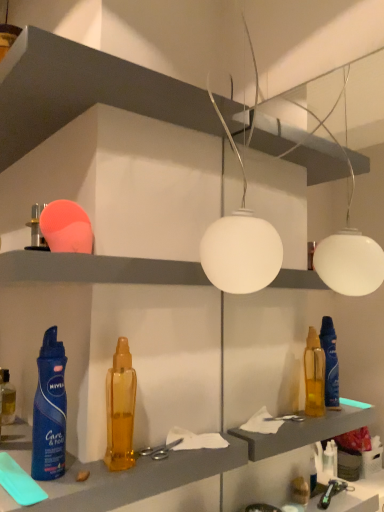
Question: Are translucent amber bottle at center, the first bottle in the right-to-left sequence, and matte plastic shelf at upper center, the 2th shelf positioned from the top, beside each other?

Choices:
 (A) yes
 (B) no

Answer: (B)

Question: Is translucent amber bottle at center, the first bottle in the right-to-left sequence, facing towards matte plastic shelf at upper center, the 2th shelf positioned from the top?

Choices:
 (A) yes
 (B) no

Answer: (B)

Question: From a real-world perspective, does translucent amber bottle at center, which is the third bottle in left-to-right order, stand above matte plastic shelf at upper center, arranged as the first shelf when ordered from the bottom?

Choices:
 (A) no
 (B) yes

Answer: (A)

Question: Can you confirm if translucent amber bottle at center, the 2th bottle viewed from the front, is positioned to the left of matte plastic shelf at upper center, the 2th shelf positioned from the top?

Choices:
 (A) yes
 (B) no

Answer: (B)

Question: Considering the relative sizes of translucent amber bottle at center, the 2th bottle viewed from the front, and matte plastic shelf at upper center, arranged as the first shelf when ordered from the bottom, in the image provided, is translucent amber bottle at center, the 2th bottle viewed from the front, taller than matte plastic shelf at upper center, arranged as the first shelf when ordered from the bottom,?

Choices:
 (A) yes
 (B) no

Answer: (A)

Question: From their relative heights in the image, would you say translucent amber bottle at center, the first bottle in the right-to-left sequence, is taller or shorter than white matte shelf at upper center, arranged as the first shelf when viewed from the top?

Choices:
 (A) short
 (B) tall

Answer: (B)

Question: Is translucent amber bottle at center, which is the third bottle in left-to-right order, spatially inside white matte shelf at upper center, the 2th shelf from the bottom, or outside of it?

Choices:
 (A) outside
 (B) inside

Answer: (A)

Question: Is translucent amber bottle at center, the first bottle in the right-to-left sequence, to the left or to the right of white matte shelf at upper center, the 2th shelf from the bottom, in the image?

Choices:
 (A) left
 (B) right

Answer: (B)

Question: Considering the positions of point (127, 421) and point (253, 142), is point (127, 421) closer or farther from the camera than point (253, 142)?

Choices:
 (A) closer
 (B) farther

Answer: (A)

Question: Relative to translucent amber bottle at lower left, which is counted as the 3th bottle, starting from the right, is silver metallic scissors at center in front or behind?

Choices:
 (A) front
 (B) behind

Answer: (A)

Question: Considering the positions of silver metallic scissors at center and translucent amber bottle at lower left, acting as the first bottle starting from the left, in the image, is silver metallic scissors at center taller or shorter than translucent amber bottle at lower left, acting as the first bottle starting from the left,?

Choices:
 (A) short
 (B) tall

Answer: (A)

Question: Do you think silver metallic scissors at center is within translucent amber bottle at lower left, which is counted as the 3th bottle, starting from the right, or outside of it?

Choices:
 (A) inside
 (B) outside

Answer: (B)

Question: From the image's perspective, is silver metallic scissors at center above or below translucent amber bottle at lower left, which is the 1th bottle in back-to-front order?

Choices:
 (A) below
 (B) above

Answer: (A)

Question: Is white matte globe at center inside the boundaries of blue matte spray can at lower left, placed as the 3th bottle when sorted from back to front, or outside?

Choices:
 (A) outside
 (B) inside

Answer: (A)

Question: From a real-world perspective, is white matte globe at center above or below blue matte spray can at lower left, which is the 1th bottle from front to back?

Choices:
 (A) above
 (B) below

Answer: (A)